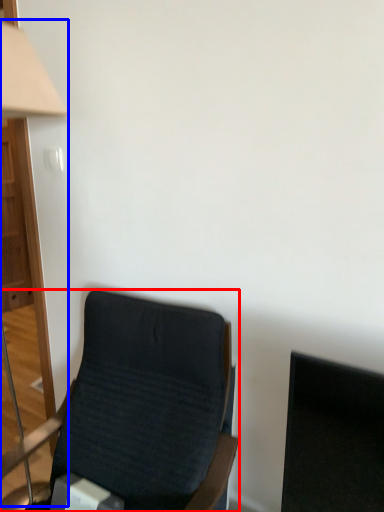
Question: Which object appears farthest to the camera in this image, chair (highlighted by a red box) or table lamp (highlighted by a blue box)?

Choices:
 (A) chair
 (B) table lamp

Answer: (B)